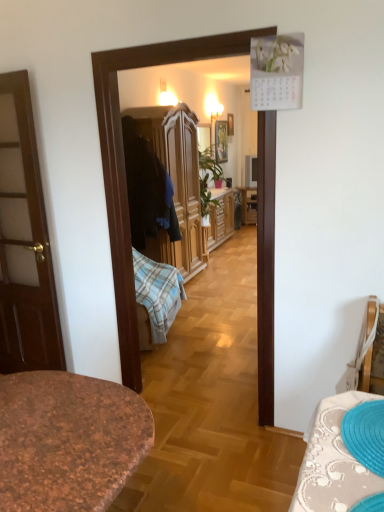
Question: Which direction should I rotate to look at wooden picture frame at center, which appears as the 2th picture frame when viewed from the right, — up or down?

Choices:
 (A) up
 (B) down

Answer: (A)

Question: Considering the relative positions of wooden picture frame at upper center, which ranks as the second picture frame in left-to-right order, and matte black television at center in the image provided, is wooden picture frame at upper center, which ranks as the second picture frame in left-to-right order, to the left of matte black television at center from the viewer's perspective?

Choices:
 (A) yes
 (B) no

Answer: (A)

Question: Is wooden picture frame at upper center, which ranks as the first picture frame in right-to-left order, located outside matte black television at center?

Choices:
 (A) no
 (B) yes

Answer: (B)

Question: From a real-world perspective, is wooden picture frame at upper center, which ranks as the first picture frame in right-to-left order, located higher than matte black television at center?

Choices:
 (A) yes
 (B) no

Answer: (A)

Question: Is wooden picture frame at upper center, which ranks as the first picture frame in right-to-left order, smaller than matte black television at center?

Choices:
 (A) yes
 (B) no

Answer: (A)

Question: Is wooden picture frame at upper center, which ranks as the second picture frame in left-to-right order, looking in the opposite direction of matte black television at center?

Choices:
 (A) yes
 (B) no

Answer: (B)

Question: Is wooden picture frame at upper center, which ranks as the first picture frame in right-to-left order, to the right of matte black television at center from the viewer's perspective?

Choices:
 (A) yes
 (B) no

Answer: (B)

Question: From the image's perspective, is wooden picture frame at upper center, which ranks as the second picture frame in left-to-right order, located beneath wooden picture frame at center, which appears as the 2th picture frame when viewed from the right?

Choices:
 (A) no
 (B) yes

Answer: (A)

Question: Is wooden picture frame at upper center, which ranks as the first picture frame in right-to-left order, far from wooden picture frame at center, marked as the 1th picture frame in a left-to-right arrangement?

Choices:
 (A) no
 (B) yes

Answer: (A)

Question: From a real-world perspective, does wooden picture frame at upper center, which ranks as the first picture frame in right-to-left order, sit lower than wooden picture frame at center, which appears as the 2th picture frame when viewed from the right?

Choices:
 (A) yes
 (B) no

Answer: (B)

Question: Is wooden picture frame at upper center, which ranks as the second picture frame in left-to-right order, to the left of wooden picture frame at center, marked as the 1th picture frame in a left-to-right arrangement, from the viewer's perspective?

Choices:
 (A) yes
 (B) no

Answer: (B)

Question: From the image's perspective, does wooden picture frame at upper center, which ranks as the first picture frame in right-to-left order, appear higher than wooden picture frame at center, which appears as the 2th picture frame when viewed from the right?

Choices:
 (A) yes
 (B) no

Answer: (A)

Question: Is the position of wooden picture frame at upper center, which ranks as the second picture frame in left-to-right order, less distant than that of wooden picture frame at center, which appears as the 2th picture frame when viewed from the right?

Choices:
 (A) no
 (B) yes

Answer: (A)

Question: Is matte black television at center thinner than wooden wardrobe at center?

Choices:
 (A) no
 (B) yes

Answer: (B)